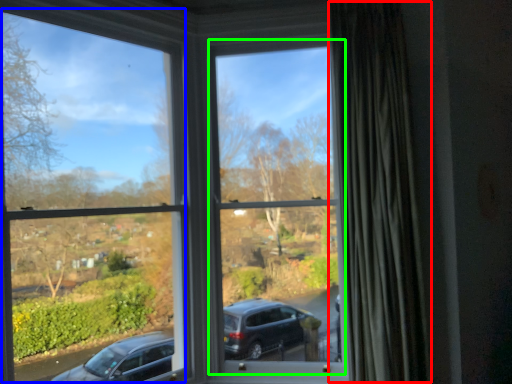
Question: Which object is positioned farthest from curtain (highlighted by a red box)? Select from window frame (highlighted by a blue box) and window frame (highlighted by a green box).

Choices:
 (A) window frame
 (B) window frame

Answer: (A)